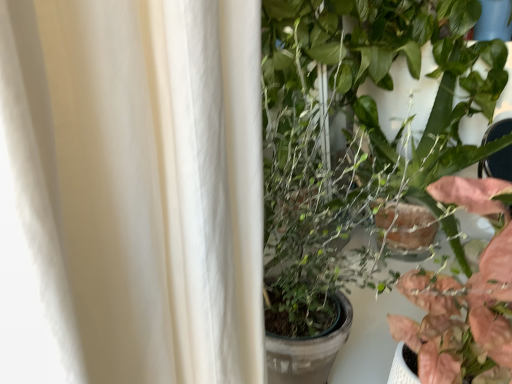
Locate an element on the screen. The width and height of the screenshot is (512, 384). pink matte leafy plant at right, positioned as the 1th houseplant in bottom-to-top order is located at coordinates (464, 298).

This screenshot has height=384, width=512. What do you see at coordinates (464, 298) in the screenshot?
I see `pink matte leafy plant at right, positioned as the second houseplant in top-to-bottom order` at bounding box center [464, 298].

Where is `green glossy plant at center, arranged as the 1th houseplant when viewed from the top`? The width and height of the screenshot is (512, 384). green glossy plant at center, arranged as the 1th houseplant when viewed from the top is located at coordinates (352, 134).

This screenshot has width=512, height=384. Describe the element at coordinates (352, 134) in the screenshot. I see `green glossy plant at center, positioned as the 2th houseplant in bottom-to-top order` at that location.

What is the approximate height of green glossy plant at center, positioned as the 2th houseplant in bottom-to-top order?

green glossy plant at center, positioned as the 2th houseplant in bottom-to-top order, is 16.79 inches in height.

How much space does green glossy plant at center, positioned as the 2th houseplant in bottom-to-top order, occupy horizontally?

green glossy plant at center, positioned as the 2th houseplant in bottom-to-top order, is 37.06 centimeters in width.

Find the location of `pink matte leafy plant at right, positioned as the second houseplant in top-to-bottom order`. pink matte leafy plant at right, positioned as the second houseplant in top-to-bottom order is located at coordinates (464, 298).

Which is more to the left, green glossy plant at center, positioned as the 2th houseplant in bottom-to-top order, or pink matte leafy plant at right, positioned as the 1th houseplant in bottom-to-top order?

pink matte leafy plant at right, positioned as the 1th houseplant in bottom-to-top order.

Considering the relative positions of green glossy plant at center, positioned as the 2th houseplant in bottom-to-top order, and pink matte leafy plant at right, positioned as the 1th houseplant in bottom-to-top order, in the image provided, is green glossy plant at center, positioned as the 2th houseplant in bottom-to-top order, in front of pink matte leafy plant at right, positioned as the 1th houseplant in bottom-to-top order,?

No, green glossy plant at center, positioned as the 2th houseplant in bottom-to-top order, is further to the viewer.

Considering the points (453, 168) and (471, 202), which point is in front, point (453, 168) or point (471, 202)?

The point (471, 202) is more forward.

From the image's perspective, is green glossy plant at center, positioned as the 2th houseplant in bottom-to-top order, beneath pink matte leafy plant at right, positioned as the second houseplant in top-to-bottom order?

No.

From a real-world perspective, is green glossy plant at center, positioned as the 2th houseplant in bottom-to-top order, physically located above or below pink matte leafy plant at right, positioned as the second houseplant in top-to-bottom order?

Clearly, from a real-world perspective, green glossy plant at center, positioned as the 2th houseplant in bottom-to-top order, is above pink matte leafy plant at right, positioned as the second houseplant in top-to-bottom order.

Consider the image. Which of these two, green glossy plant at center, arranged as the 1th houseplant when viewed from the top, or pink matte leafy plant at right, positioned as the second houseplant in top-to-bottom order, is thinner?

pink matte leafy plant at right, positioned as the second houseplant in top-to-bottom order.

Which of these two, green glossy plant at center, arranged as the 1th houseplant when viewed from the top, or pink matte leafy plant at right, positioned as the second houseplant in top-to-bottom order, stands shorter?

Standing shorter between the two is pink matte leafy plant at right, positioned as the second houseplant in top-to-bottom order.

Between green glossy plant at center, positioned as the 2th houseplant in bottom-to-top order, and pink matte leafy plant at right, positioned as the second houseplant in top-to-bottom order, which one has smaller size?

Smaller between the two is pink matte leafy plant at right, positioned as the second houseplant in top-to-bottom order.

Is green glossy plant at center, arranged as the 1th houseplant when viewed from the top, positioned beyond the bounds of pink matte leafy plant at right, positioned as the 1th houseplant in bottom-to-top order?

Yes, green glossy plant at center, arranged as the 1th houseplant when viewed from the top, is outside of pink matte leafy plant at right, positioned as the 1th houseplant in bottom-to-top order.

Is green glossy plant at center, positioned as the 2th houseplant in bottom-to-top order, in contact with pink matte leafy plant at right, positioned as the second houseplant in top-to-bottom order?

green glossy plant at center, positioned as the 2th houseplant in bottom-to-top order, is not next to pink matte leafy plant at right, positioned as the second houseplant in top-to-bottom order, and they're not touching.

Is green glossy plant at center, arranged as the 1th houseplant when viewed from the top, positioned with its back to pink matte leafy plant at right, positioned as the second houseplant in top-to-bottom order?

No, green glossy plant at center, arranged as the 1th houseplant when viewed from the top, is not facing the opposite direction of pink matte leafy plant at right, positioned as the second houseplant in top-to-bottom order.

What's the angular difference between green glossy plant at center, positioned as the 2th houseplant in bottom-to-top order, and pink matte leafy plant at right, positioned as the 1th houseplant in bottom-to-top order,'s facing directions?

8.12e-05 degrees.

Could you measure the distance between green glossy plant at center, positioned as the 2th houseplant in bottom-to-top order, and pink matte leafy plant at right, positioned as the second houseplant in top-to-bottom order?

green glossy plant at center, positioned as the 2th houseplant in bottom-to-top order, and pink matte leafy plant at right, positioned as the second houseplant in top-to-bottom order, are 11.44 inches apart.

What are the coordinates of `houseplant above the pink matte leafy plant at right, positioned as the second houseplant in top-to-bottom order (from a real-world perspective)` in the screenshot? It's located at [352, 134].

Which object is positioned more to the right, pink matte leafy plant at right, positioned as the 1th houseplant in bottom-to-top order, or green glossy plant at center, arranged as the 1th houseplant when viewed from the top?

Positioned to the right is green glossy plant at center, arranged as the 1th houseplant when viewed from the top.

Considering the positions of objects pink matte leafy plant at right, positioned as the second houseplant in top-to-bottom order, and green glossy plant at center, arranged as the 1th houseplant when viewed from the top, in the image provided, who is in front, pink matte leafy plant at right, positioned as the second houseplant in top-to-bottom order, or green glossy plant at center, arranged as the 1th houseplant when viewed from the top,?

pink matte leafy plant at right, positioned as the second houseplant in top-to-bottom order, is more forward.

Which is nearer, (426,355) or (368,54)?

Positioned in front is point (426,355).

In the scene shown: From the image's perspective, which is below, pink matte leafy plant at right, positioned as the 1th houseplant in bottom-to-top order, or green glossy plant at center, arranged as the 1th houseplant when viewed from the top?

pink matte leafy plant at right, positioned as the 1th houseplant in bottom-to-top order, is shown below in the image.

From a real-world perspective, is pink matte leafy plant at right, positioned as the second houseplant in top-to-bottom order, positioned under green glossy plant at center, positioned as the 2th houseplant in bottom-to-top order, based on gravity?

Indeed, from a real-world perspective, pink matte leafy plant at right, positioned as the second houseplant in top-to-bottom order, is positioned beneath green glossy plant at center, positioned as the 2th houseplant in bottom-to-top order.

Between pink matte leafy plant at right, positioned as the second houseplant in top-to-bottom order, and green glossy plant at center, arranged as the 1th houseplant when viewed from the top, which one has larger width?

With larger width is green glossy plant at center, arranged as the 1th houseplant when viewed from the top.

Does pink matte leafy plant at right, positioned as the 1th houseplant in bottom-to-top order, have a greater height compared to green glossy plant at center, arranged as the 1th houseplant when viewed from the top?

No.

Considering the sizes of objects pink matte leafy plant at right, positioned as the second houseplant in top-to-bottom order, and green glossy plant at center, arranged as the 1th houseplant when viewed from the top, in the image provided, who is bigger, pink matte leafy plant at right, positioned as the second houseplant in top-to-bottom order, or green glossy plant at center, arranged as the 1th houseplant when viewed from the top,?

green glossy plant at center, arranged as the 1th houseplant when viewed from the top.

Would you say pink matte leafy plant at right, positioned as the second houseplant in top-to-bottom order, is inside or outside green glossy plant at center, positioned as the 2th houseplant in bottom-to-top order?

pink matte leafy plant at right, positioned as the second houseplant in top-to-bottom order, is not inside green glossy plant at center, positioned as the 2th houseplant in bottom-to-top order, it's outside.

Would you say pink matte leafy plant at right, positioned as the 1th houseplant in bottom-to-top order, is a long distance from green glossy plant at center, positioned as the 2th houseplant in bottom-to-top order?

No, there isn't a large distance between pink matte leafy plant at right, positioned as the 1th houseplant in bottom-to-top order, and green glossy plant at center, positioned as the 2th houseplant in bottom-to-top order.

Is pink matte leafy plant at right, positioned as the 1th houseplant in bottom-to-top order, facing towards green glossy plant at center, positioned as the 2th houseplant in bottom-to-top order?

No, pink matte leafy plant at right, positioned as the 1th houseplant in bottom-to-top order, is not aimed at green glossy plant at center, positioned as the 2th houseplant in bottom-to-top order.

What are the coordinates of `houseplant above the pink matte leafy plant at right, positioned as the second houseplant in top-to-bottom order (from the image's perspective)` in the screenshot? It's located at (352, 134).

You are a GUI agent. You are given a task and a screenshot of the screen. Output one action in this format:
    pyautogui.click(x=<x>, y=<y>)
    Task: Click on the houseplant above the pink matte leafy plant at right, positioned as the 1th houseplant in bottom-to-top order (from a real-world perspective)
    This screenshot has height=384, width=512.
    Given the screenshot: What is the action you would take?
    (352, 134)

Find the location of a particular element. The image size is (512, 384). houseplant below the green glossy plant at center, positioned as the 2th houseplant in bottom-to-top order (from the image's perspective) is located at coordinates (464, 298).